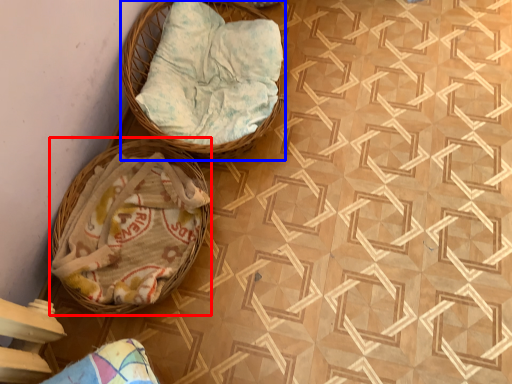
Question: Which of the following is the closest to the observer, basket (highlighted by a red box) or basket (highlighted by a blue box)?

Choices:
 (A) basket
 (B) basket

Answer: (A)